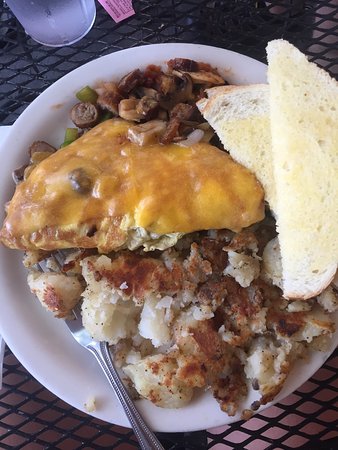
Find the location of a particular element. Image resolution: width=338 pixels, height=450 pixels. glass is located at coordinates (69, 20).